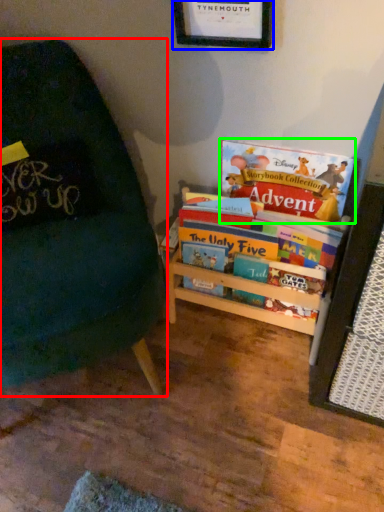
Question: Considering the real-world distances, which object is closest to chair (highlighted by a red box)? picture frame (highlighted by a blue box) or book (highlighted by a green box).

Choices:
 (A) picture frame
 (B) book

Answer: (B)